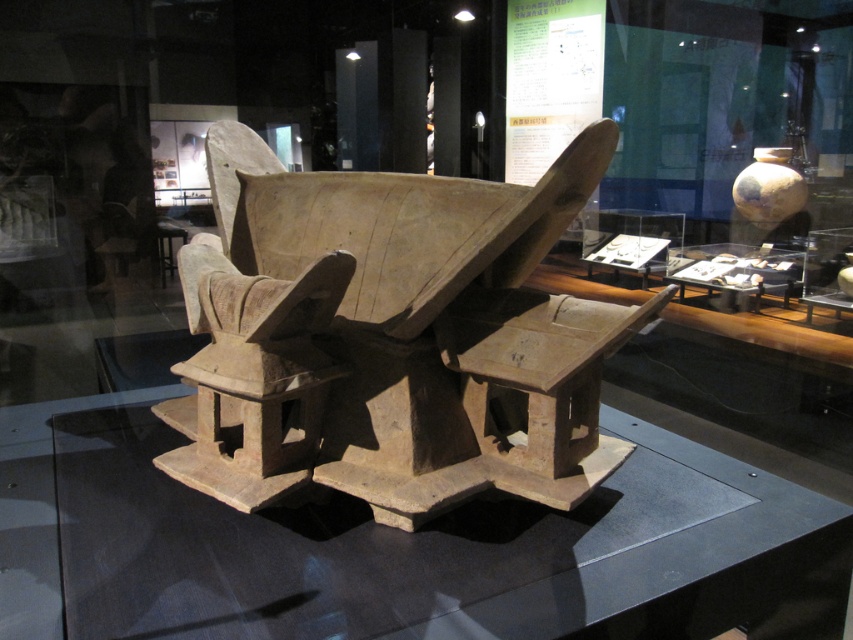
Looking at this image, you are a museum visitor standing in front of the exhibit. You notice the brown clay structure at center and the transparent glass table at center. Which object is positioned higher relative to the other?

The brown clay structure at center is located above the transparent glass table at center, so it is positioned higher.

You are a museum visitor standing in front of the transparent glass table at center. You want to place a small artifact on the brown clay structure at center. Can you reach it from your current position without moving your feet?

The brown clay structure at center is to the right of transparent glass table at center, so yes, you can reach it by extending your arm to the right from your current position at the transparent glass table at center.